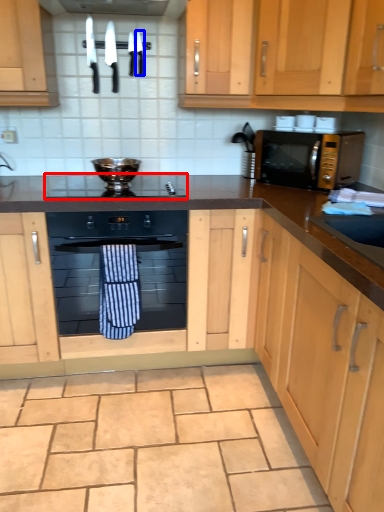
Question: Among these objects, which one is farthest to the camera, gas stove (highlighted by a red box) or knife (highlighted by a blue box)?

Choices:
 (A) gas stove
 (B) knife

Answer: (B)